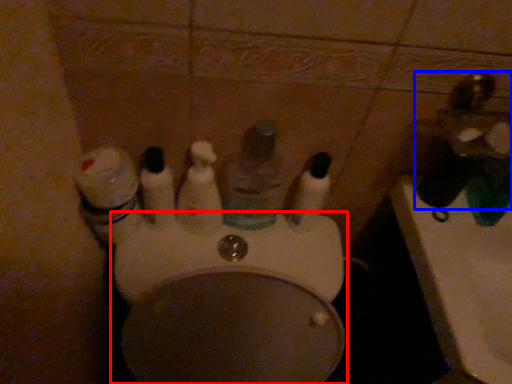
Question: Among these objects, which one is farthest to the camera, toilet (highlighted by a red box) or faucet (highlighted by a blue box)?

Choices:
 (A) toilet
 (B) faucet

Answer: (B)